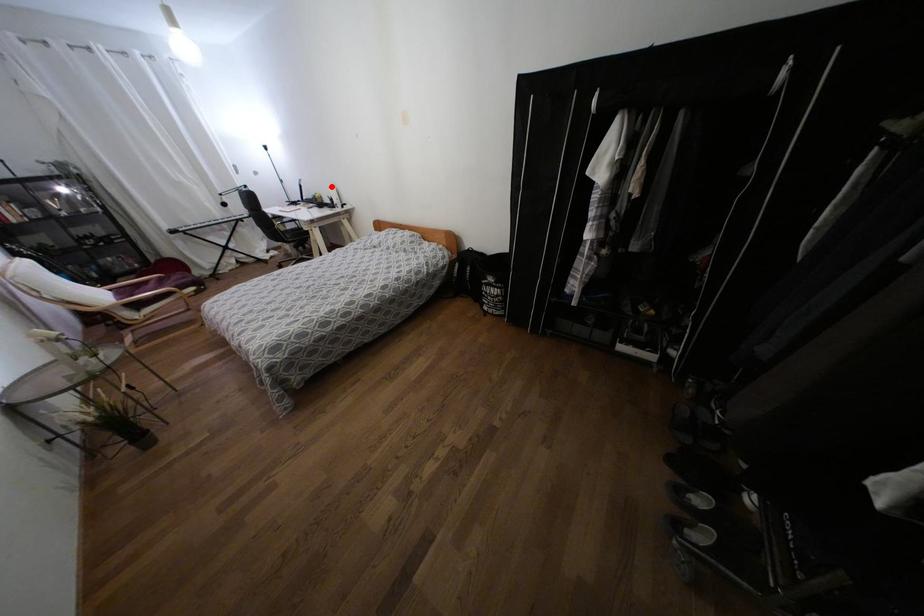
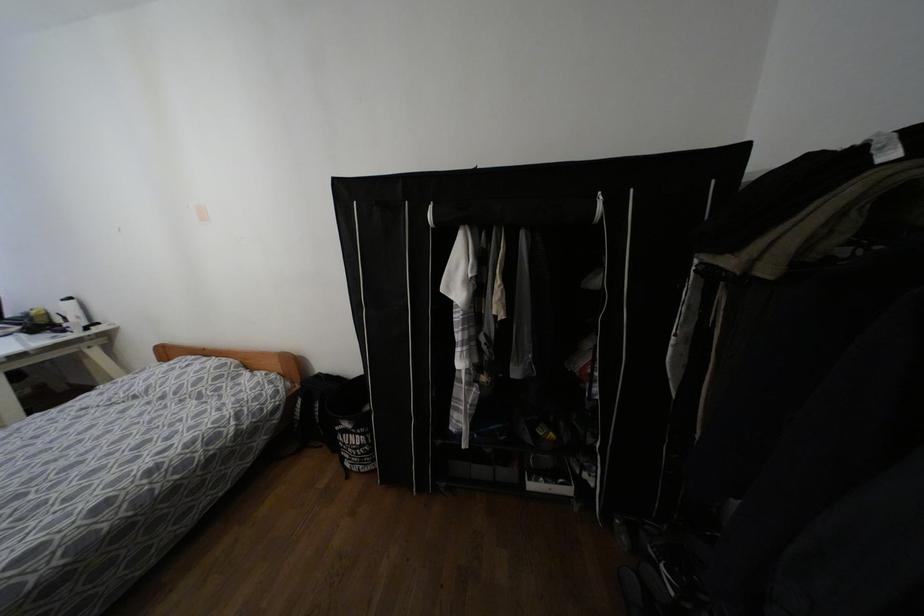
In the second image, find the point that corresponds to the highlighted location in the first image.

(68, 299)